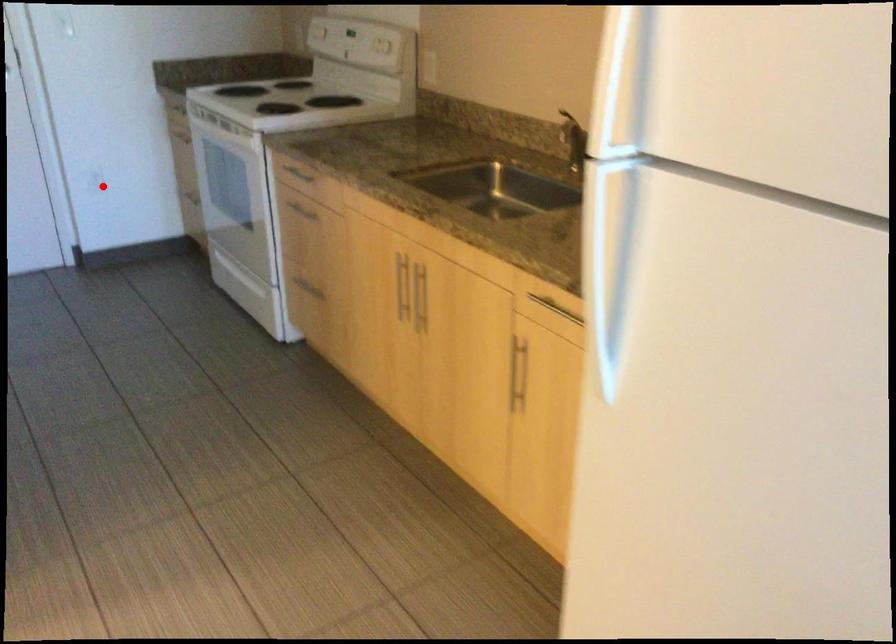
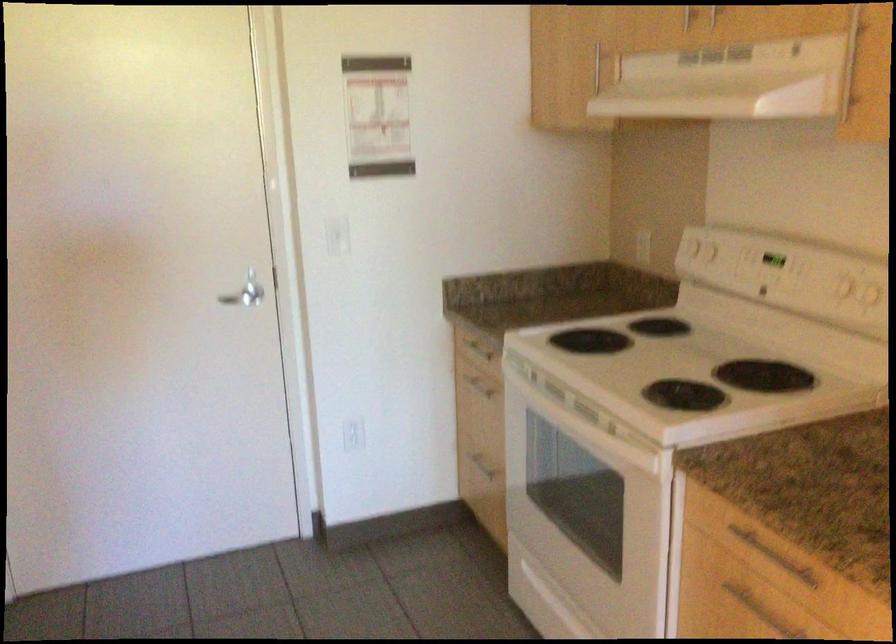
Question: I am providing you with two images of the same scene from different viewpoints. Given a red point in image1, look at the same physical point in image2. Is it:

Choices:
 (A) Closer to the viewpoint
 (B) Farther from the viewpoint

Answer: (A)